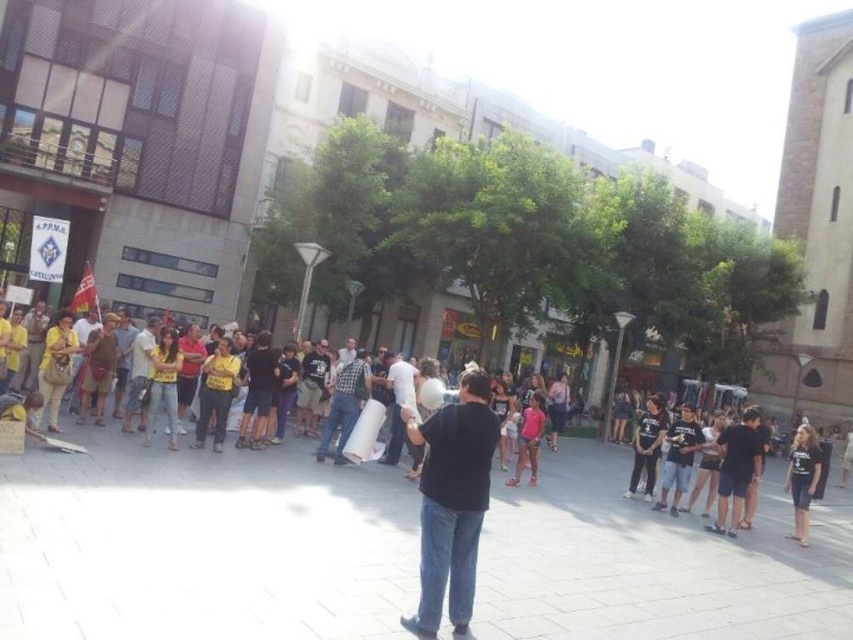
You are standing in the square and want to walk from the point at coordinates (352,403) to the point at coordinates (795,444). Which direction should you move to get closer to your destination?

You should move away from the viewer because point (352,403) is closer to the viewer than point (795,444). Moving away from the viewer will take you towards the destination.